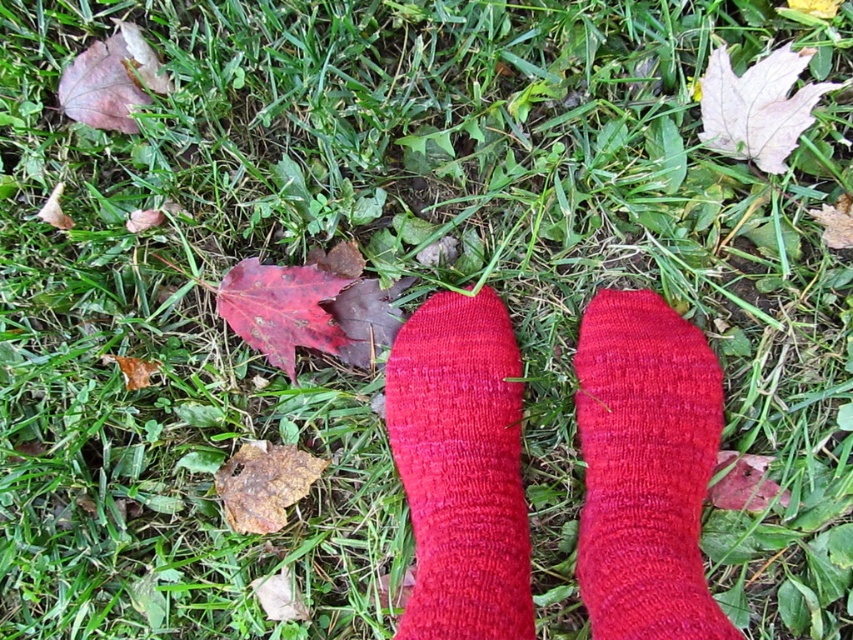
Question: Can you confirm if knitted red sock at center is thinner than matte red sock at center?

Choices:
 (A) no
 (B) yes

Answer: (A)

Question: From the image, what is the correct spatial relationship of knitted red sock at center in relation to matte red sock at center?

Choices:
 (A) left
 (B) right

Answer: (B)

Question: Which object appears closest to the camera in this image?

Choices:
 (A) knitted red sock at center
 (B) matte red sock at center

Answer: (A)

Question: Is knitted red sock at center above matte red sock at center?

Choices:
 (A) no
 (B) yes

Answer: (B)